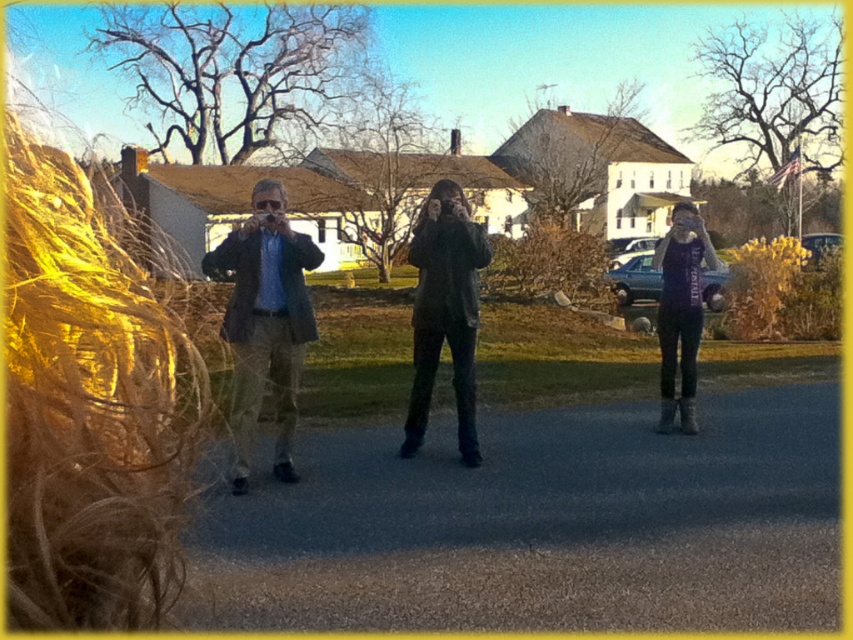
Can you confirm if matte brown jacket at center is thinner than purple jersey at center?

Correct, matte brown jacket at center's width is less than purple jersey at center's.

Who is taller, matte brown jacket at center or purple jersey at center?

Standing taller between the two is purple jersey at center.

Who is more distant from viewer, (274, 240) or (686, 214)?

The point (686, 214) is more distant.

What are the coordinates of `matte brown jacket at center` in the screenshot? It's located at (265, 321).

Between point (436, 220) and point (679, 355), which one is positioned behind?

The point (679, 355) is behind.

Looking at this image, does dark gray fabric jacket at center appear over purple jersey at center?

Indeed, dark gray fabric jacket at center is positioned over purple jersey at center.

You are a GUI agent. You are given a task and a screenshot of the screen. Output one action in this format:
    pyautogui.click(x=<x>, y=<y>)
    Task: Click on the dark gray fabric jacket at center
    Image resolution: width=853 pixels, height=640 pixels.
    Given the screenshot: What is the action you would take?
    pyautogui.click(x=445, y=310)

Can you confirm if matte brown jacket at center is positioned above dark gray fabric jacket at center?

No, matte brown jacket at center is not above dark gray fabric jacket at center.

Between matte brown jacket at center and dark gray fabric jacket at center, which one has more height?

Answer: Standing taller between the two is dark gray fabric jacket at center.

Is point (277, 445) behind point (421, 220)?

No.

Locate an element on the screen. The image size is (853, 640). matte brown jacket at center is located at coordinates (265, 321).